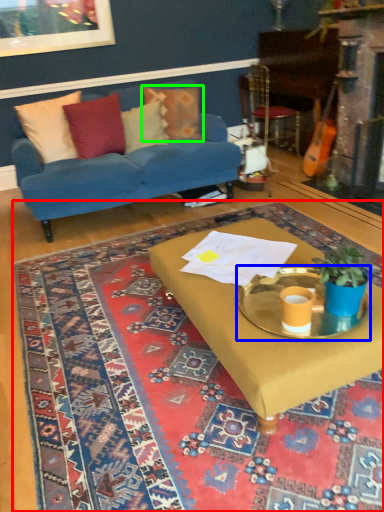
Question: Considering the real-world distances, which object is closest to mat (highlighted by a red box)? round table (highlighted by a blue box) or pillow (highlighted by a green box).

Choices:
 (A) round table
 (B) pillow

Answer: (A)